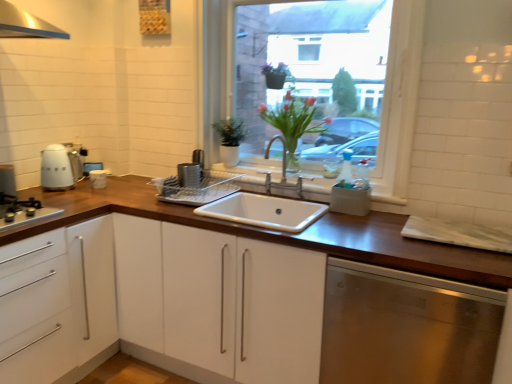
Question: From the image's perspective, would you say white matte cabinet at center, which is the second cabinetry in left-to-right order, is shown under black matte gas stove at left?

Choices:
 (A) no
 (B) yes

Answer: (B)

Question: Considering the relative positions of white matte cabinet at center, the first cabinetry in the right-to-left sequence, and black matte gas stove at left in the image provided, is white matte cabinet at center, the first cabinetry in the right-to-left sequence, to the right of black matte gas stove at left from the viewer's perspective?

Choices:
 (A) no
 (B) yes

Answer: (B)

Question: Is white matte cabinet at center, which is the second cabinetry in left-to-right order, in contact with black matte gas stove at left?

Choices:
 (A) yes
 (B) no

Answer: (B)

Question: Does white matte cabinet at center, the first cabinetry in the right-to-left sequence, come behind black matte gas stove at left?

Choices:
 (A) yes
 (B) no

Answer: (A)

Question: Is white matte cabinet at center, which is the second cabinetry in left-to-right order, outside of black matte gas stove at left?

Choices:
 (A) yes
 (B) no

Answer: (A)

Question: Is clear glass window at center bigger or smaller than white matte cabinet at center, which is the second cabinetry in left-to-right order?

Choices:
 (A) big
 (B) small

Answer: (B)

Question: Does point (407, 84) appear closer or farther from the camera than point (510, 334)?

Choices:
 (A) farther
 (B) closer

Answer: (A)

Question: In terms of height, does clear glass window at center look taller or shorter compared to white matte cabinet at center, which is the second cabinetry in left-to-right order?

Choices:
 (A) short
 (B) tall

Answer: (B)

Question: From the image's perspective, relative to white matte cabinet at center, which is the second cabinetry in left-to-right order, is clear glass window at center above or below?

Choices:
 (A) below
 (B) above

Answer: (B)

Question: From the image's perspective, is clear glass window at center located above or below black matte gas stove at left?

Choices:
 (A) below
 (B) above

Answer: (B)

Question: Considering the relative positions of clear glass window at center and black matte gas stove at left in the image provided, is clear glass window at center to the left or to the right of black matte gas stove at left?

Choices:
 (A) right
 (B) left

Answer: (A)

Question: In terms of width, does clear glass window at center look wider or thinner when compared to black matte gas stove at left?

Choices:
 (A) thin
 (B) wide

Answer: (A)

Question: Which is correct: clear glass window at center is inside black matte gas stove at left, or outside of it?

Choices:
 (A) inside
 (B) outside

Answer: (B)

Question: From the image's perspective, relative to stainless steel dishwasher at lower right, is matte white kettle at left above or below?

Choices:
 (A) below
 (B) above

Answer: (B)

Question: Considering the positions of matte white kettle at left and stainless steel dishwasher at lower right in the image, is matte white kettle at left wider or thinner than stainless steel dishwasher at lower right?

Choices:
 (A) wide
 (B) thin

Answer: (B)